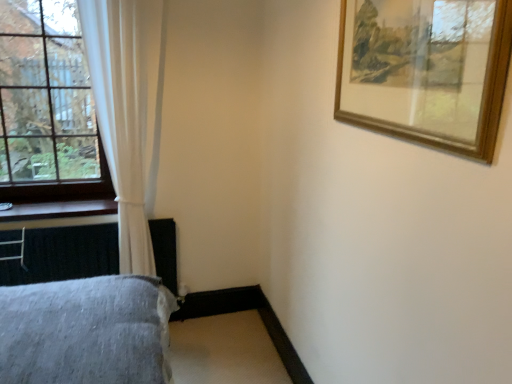
The width and height of the screenshot is (512, 384). Describe the element at coordinates (425, 71) in the screenshot. I see `wooden picture frame at upper right` at that location.

This screenshot has width=512, height=384. What do you see at coordinates (59, 210) in the screenshot? I see `wooden at left` at bounding box center [59, 210].

Find the location of a particular element. This screenshot has width=512, height=384. gray fabric bed at lower left is located at coordinates (77, 331).

Locate an element on the screen. white sheer curtain at left is located at coordinates [x=127, y=112].

Is gray fabric bed at lower left at the right side of clear glass window at left?

Correct, you'll find gray fabric bed at lower left to the right of clear glass window at left.

Is gray fabric bed at lower left not within clear glass window at left?

That's correct, gray fabric bed at lower left is outside of clear glass window at left.

How distant is gray fabric bed at lower left from clear glass window at left?

gray fabric bed at lower left and clear glass window at left are 3.76 feet apart from each other.

Is gray fabric bed at lower left oriented towards clear glass window at left?

No, gray fabric bed at lower left is not facing towards clear glass window at left.

From the image's perspective, between clear glass window at left and white sheer curtain at left, which one is located above?

clear glass window at left appears higher in the image.

Based on their positions, is clear glass window at left located to the left or right of white sheer curtain at left?

Clearly, clear glass window at left is on the left of white sheer curtain at left in the image.

Find the location of a particular element. This screenshot has height=384, width=512. window on the left of white sheer curtain at left is located at coordinates (47, 108).

Is clear glass window at left facing away from wooden at left?

clear glass window at left is not turned away from wooden at left.

From a real-world perspective, is clear glass window at left positioned under wooden at left based on gravity?

No, from a real-world perspective, clear glass window at left is not below wooden at left.

Is clear glass window at left next to wooden at left and touching it?

No.

Considering the relative sizes of clear glass window at left and wooden at left in the image provided, is clear glass window at left taller than wooden at left?

Indeed, clear glass window at left has a greater height compared to wooden at left.

Is the surface of gray fabric bed at lower left in direct contact with white sheer curtain at left?

No, gray fabric bed at lower left is not making contact with white sheer curtain at left.

Who is more distant, gray fabric bed at lower left or white sheer curtain at left?

gray fabric bed at lower left is further away from the camera.

From the image's perspective, which is above, gray fabric bed at lower left or white sheer curtain at left?

white sheer curtain at left appears higher in the image.

Locate an element on the screen. Image resolution: width=512 pixels, height=384 pixels. bed behind the white sheer curtain at left is located at coordinates (77, 331).

Consider the image. Would you say wooden at left is inside or outside wooden picture frame at upper right?

wooden at left is not enclosed by wooden picture frame at upper right.

From the image's perspective, relative to wooden picture frame at upper right, is wooden at left above or below?

Based on their image positions, wooden at left is located beneath wooden picture frame at upper right.

Between wooden at left and wooden picture frame at upper right, which one has more height?

wooden picture frame at upper right is taller.

Which is in front, wooden at left or clear glass window at left?

clear glass window at left is closer to the camera.

Looking at this image, from a real-world perspective, is wooden at left over clear glass window at left?

No, from a real-world perspective, wooden at left is not on top of clear glass window at left.

In order to click on window that is above the wooden at left (from the image's perspective) in this screenshot , I will do `click(47, 108)`.

Is wooden at left oriented towards clear glass window at left?

No, wooden at left is not oriented towards clear glass window at left.

Considering the sizes of objects white sheer curtain at left and wooden at left in the image provided, who is taller, white sheer curtain at left or wooden at left?

white sheer curtain at left is taller.

From a real-world perspective, between white sheer curtain at left and wooden at left, who is vertically lower?

wooden at left is physically lower.

Is white sheer curtain at left facing away from wooden at left?

No, white sheer curtain at left's orientation is not away from wooden at left.

From the image's perspective, which is below, white sheer curtain at left or wooden at left?

wooden at left, from the image's perspective.

This screenshot has height=384, width=512. What are the coordinates of `bed that appears behind the clear glass window at left` in the screenshot? It's located at (77, 331).

The width and height of the screenshot is (512, 384). In order to click on curtain located in front of the clear glass window at left in this screenshot , I will do `click(127, 112)`.

Looking at the image, which one is located further to wooden at left, clear glass window at left or white sheer curtain at left?

white sheer curtain at left is positioned further to the anchor wooden at left.

Based on their spatial positions, is gray fabric bed at lower left or wooden at left further from clear glass window at left?

Based on the image, gray fabric bed at lower left appears to be further to clear glass window at left.

Estimate the real-world distances between objects in this image. Which object is further from white sheer curtain at left, clear glass window at left or wooden at left?

wooden at left lies further to white sheer curtain at left than the other object.

Estimate the real-world distances between objects in this image. Which object is further from clear glass window at left, wooden at left or white sheer curtain at left?

wooden at left is positioned further to the anchor clear glass window at left.

When comparing their distances from wooden picture frame at upper right, does gray fabric bed at lower left or wooden at left seem further?

wooden at left is further to wooden picture frame at upper right.

Estimate the real-world distances between objects in this image. Which object is closer to clear glass window at left, white sheer curtain at left or wooden at left?

white sheer curtain at left lies closer to clear glass window at left than the other object.

Which object lies further to the anchor point gray fabric bed at lower left, wooden picture frame at upper right or clear glass window at left?

clear glass window at left is positioned further to the anchor gray fabric bed at lower left.

Estimate the real-world distances between objects in this image. Which object is further from wooden picture frame at upper right, white sheer curtain at left or clear glass window at left?

clear glass window at left.

You are a GUI agent. You are given a task and a screenshot of the screen. Output one action in this format:
    pyautogui.click(x=<x>, y=<y>)
    Task: Click on the curtain between wooden picture frame at upper right and wooden at left along the z-axis
    The height and width of the screenshot is (384, 512).
    Given the screenshot: What is the action you would take?
    pyautogui.click(x=127, y=112)

I want to click on bed between wooden picture frame at upper right and wooden at left from front to back, so click(x=77, y=331).

The width and height of the screenshot is (512, 384). Find the location of `curtain between wooden picture frame at upper right and gray fabric bed at lower left along the z-axis`. curtain between wooden picture frame at upper right and gray fabric bed at lower left along the z-axis is located at coordinates (127, 112).

Identify the location of curtain located between clear glass window at left and wooden picture frame at upper right in the left-right direction. This screenshot has height=384, width=512. (127, 112).